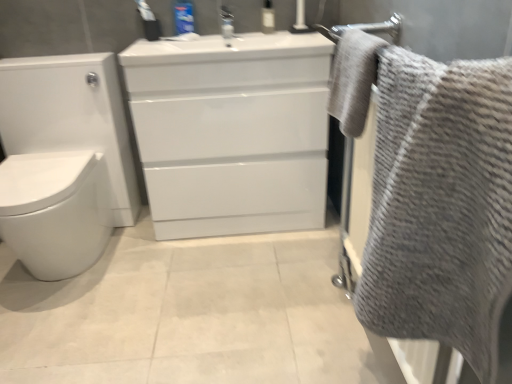
Question: Is transparent plastic bottle at upper center, which ranks as the first toiletry in right-to-left order, facing towards white glossy cabinet at center?

Choices:
 (A) no
 (B) yes

Answer: (A)

Question: Are transparent plastic bottle at upper center, which ranks as the first toiletry in right-to-left order, and white glossy cabinet at center making contact?

Choices:
 (A) yes
 (B) no

Answer: (B)

Question: From a real-world perspective, is transparent plastic bottle at upper center, which ranks as the first toiletry in right-to-left order, positioned over white glossy cabinet at center based on gravity?

Choices:
 (A) yes
 (B) no

Answer: (A)

Question: Can you confirm if transparent plastic bottle at upper center, the second toiletry positioned from the left, is taller than white glossy cabinet at center?

Choices:
 (A) yes
 (B) no

Answer: (B)

Question: From a real-world perspective, is transparent plastic bottle at upper center, the second toiletry positioned from the left, under white glossy cabinet at center?

Choices:
 (A) yes
 (B) no

Answer: (B)

Question: Does transparent plastic bottle at upper center, which ranks as the first toiletry in right-to-left order, have a lesser width compared to white glossy cabinet at center?

Choices:
 (A) no
 (B) yes

Answer: (B)

Question: Are blue plastic toothpaste tube at upper center, which is counted as the 1th toiletry, starting from the left, and white glossy toilet at left located far from each other?

Choices:
 (A) yes
 (B) no

Answer: (B)

Question: Is blue plastic toothpaste tube at upper center, which is counted as the 1th toiletry, starting from the left, at the right side of white glossy toilet at left?

Choices:
 (A) no
 (B) yes

Answer: (B)

Question: From a real-world perspective, is blue plastic toothpaste tube at upper center, which is counted as the 1th toiletry, starting from the left, beneath white glossy toilet at left?

Choices:
 (A) no
 (B) yes

Answer: (A)

Question: From the image's perspective, would you say blue plastic toothpaste tube at upper center, which is counted as the 1th toiletry, starting from the left, is shown under white glossy toilet at left?

Choices:
 (A) no
 (B) yes

Answer: (A)

Question: Does blue plastic toothpaste tube at upper center, placed as the second toiletry when sorted from right to left, turn towards white glossy toilet at left?

Choices:
 (A) yes
 (B) no

Answer: (B)

Question: Is blue plastic toothpaste tube at upper center, placed as the second toiletry when sorted from right to left, thinner than white glossy toilet at left?

Choices:
 (A) yes
 (B) no

Answer: (A)

Question: Does gray textured towel at upper right, which is the 2th bath towel from bottom to top, contain blue plastic toothpaste tube at upper center, which is counted as the 1th toiletry, starting from the left?

Choices:
 (A) no
 (B) yes

Answer: (A)